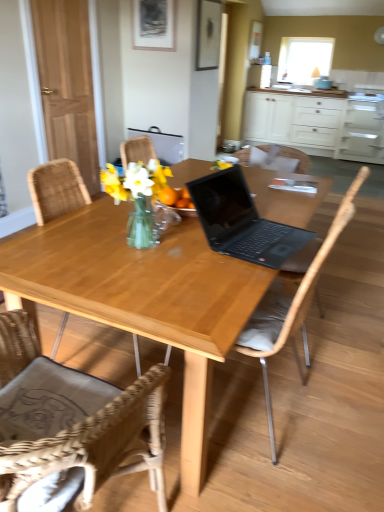
At what (x,y) coordinates should I click in order to perform the action: click on vacant area that lies in front of black matte laptop at center. Please return your answer as a coordinate pair (x, y). This screenshot has width=384, height=512. Looking at the image, I should click on (210, 288).